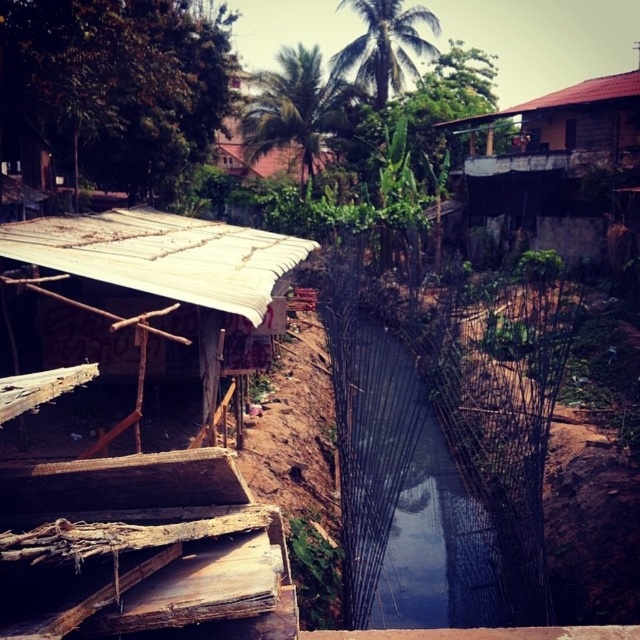
Question: Which point appears closest to the camera in this image?

Choices:
 (A) (376, 541)
 (B) (292, 131)

Answer: (A)

Question: Does transparent plastic water at center have a smaller size compared to natural bamboo hut at left?

Choices:
 (A) no
 (B) yes

Answer: (A)

Question: Does transparent plastic water at center have a smaller size compared to natural bamboo hut at left?

Choices:
 (A) no
 (B) yes

Answer: (A)

Question: Which of these objects is positioned closest to the natural bamboo hut at left?

Choices:
 (A) transparent plastic water at center
 (B) brown wooden hut at upper center

Answer: (A)

Question: Which object is positioned closest to the transparent plastic water at center?

Choices:
 (A) natural bamboo hut at left
 (B) brown wooden hut at upper center
 (C) brown wooden hut at upper right

Answer: (A)

Question: Is transparent plastic water at center thinner than brown wooden hut at upper center?

Choices:
 (A) yes
 (B) no

Answer: (A)